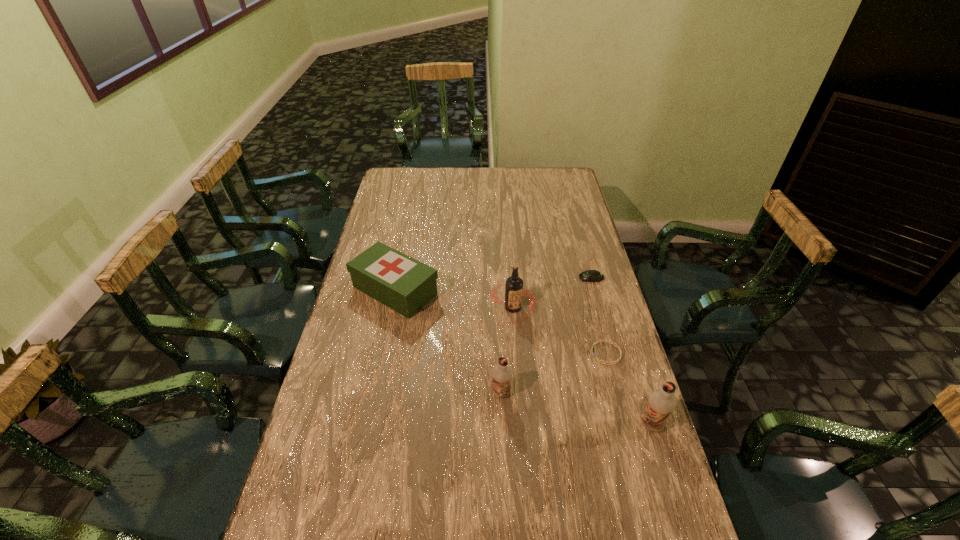
Where is `free location that satisfies the following two spatial constraints: 1. on the back side of the right chocolate milk; 2. on the wheel side of the fifth tallest object`? free location that satisfies the following two spatial constraints: 1. on the back side of the right chocolate milk; 2. on the wheel side of the fifth tallest object is located at coordinates (606, 278).

Where is `vacant space that satisfies the following two spatial constraints: 1. on the wheel side of the fifth tallest object; 2. on the right side of the nearer chocolate milk`? vacant space that satisfies the following two spatial constraints: 1. on the wheel side of the fifth tallest object; 2. on the right side of the nearer chocolate milk is located at coordinates (632, 424).

The width and height of the screenshot is (960, 540). Find the location of `free point that satisfies the following two spatial constraints: 1. on the wheel side of the computer mouse; 2. on the left side of the nearest object`. free point that satisfies the following two spatial constraints: 1. on the wheel side of the computer mouse; 2. on the left side of the nearest object is located at coordinates (632, 424).

This screenshot has width=960, height=540. What are the coordinates of `free spot that satisfies the following two spatial constraints: 1. on the back side of the nearest object; 2. on the surface of the shortest object showing star-shaped elements` in the screenshot? It's located at (630, 353).

You are a GUI agent. You are given a task and a screenshot of the screen. Output one action in this format:
    pyautogui.click(x=<x>, y=<y>)
    Task: Click on the free space that satisfies the following two spatial constraints: 1. on the surface of the third nearest object showing star-shaped elements; 2. on the left side of the nearer chocolate milk
    The height and width of the screenshot is (540, 960).
    Given the screenshot: What is the action you would take?
    pyautogui.click(x=625, y=424)

Locate an element on the screen. free region that satisfies the following two spatial constraints: 1. on the wheel side of the second shortest object; 2. on the label of the root beer is located at coordinates (600, 308).